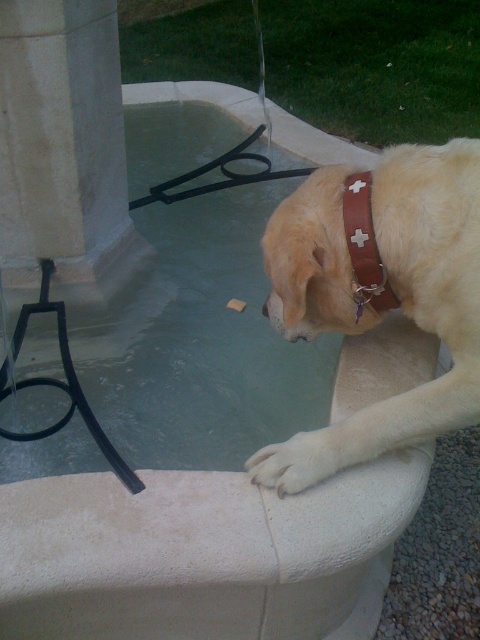
Does point (420, 394) come farther from viewer compared to point (92, 44)?

No, (420, 394) is closer to viewer.

The height and width of the screenshot is (640, 480). What are the coordinates of `light brown leather collar at upper right` in the screenshot? It's located at (379, 292).

I want to click on light brown leather collar at upper right, so click(379, 292).

Measure the distance from white stone pillar at left to white fur paw at lower center.

4.17 feet

Does white stone pillar at left come behind white fur paw at lower center?

Yes, it is.

Which is in front, point (27, 13) or point (260, 474)?

Point (260, 474) is more forward.

The width and height of the screenshot is (480, 640). Find the location of `white stone pillar at left`. white stone pillar at left is located at coordinates (63, 150).

Does light brown leather collar at upper right have a greater width compared to brown leather neckband at upper right?

Yes.

Does point (374, 202) come behind point (372, 248)?

That is True.

This screenshot has height=640, width=480. I want to click on light brown leather collar at upper right, so click(x=379, y=292).